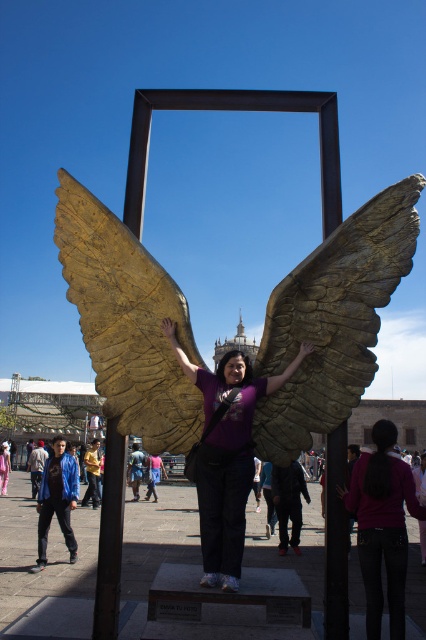
Can you confirm if gold textured wings at center is positioned to the right of blue denim jeans at center?

Indeed, gold textured wings at center is positioned on the right side of blue denim jeans at center.

Can you confirm if gold textured wings at center is shorter than blue denim jeans at center?

Incorrect, gold textured wings at center's height does not fall short of blue denim jeans at center's.

Describe the element at coordinates (333, 321) in the screenshot. I see `gold textured wings at center` at that location.

Where is `gold textured wings at center`? The width and height of the screenshot is (426, 640). gold textured wings at center is located at coordinates (333, 321).

Who is more forward, (224, 413) or (163, 474)?

Point (224, 413)

Measure the distance between point (x=221, y=397) and camera.

Point (x=221, y=397) and camera are 147.47 feet apart.

I want to click on purple matte shirt at center, so click(x=226, y=456).

Is gold textured wings at center positioned before purple matte shirt at center?

No, gold textured wings at center is further to the viewer.

This screenshot has height=640, width=426. What do you see at coordinates (333, 321) in the screenshot?
I see `gold textured wings at center` at bounding box center [333, 321].

This screenshot has height=640, width=426. I want to click on gold textured wings at center, so click(x=333, y=321).